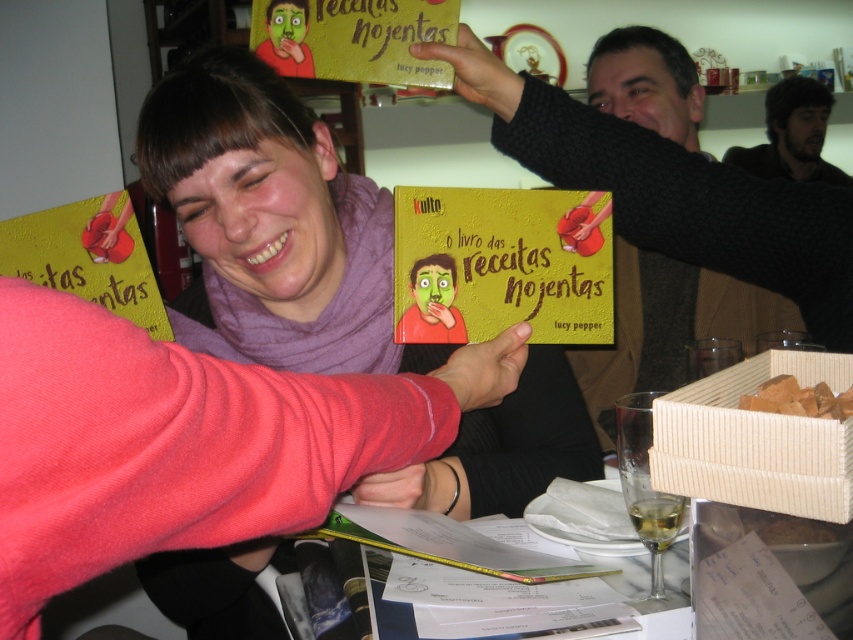
You are at a book signing event and want to place a new book into the beige woven basket at lower right. However, you notice the dark brown hair at upper right is nearby. Based on their heights, will the book fit into the basket without the hair blocking it?

The beige woven basket at lower right is not as tall as the dark brown hair at upper right, so the book should fit into the basket without being blocked by the hair.

You are at a book signing event and see a beige woven basket at lower right and a dark brown hair at upper right. Which object is smaller in size?

The beige woven basket at lower right is smaller in size compared to the dark brown hair at upper right.

You are standing in the scene and want to place a 12 inch long object in the beige woven basket at lower right. Can you fit it inside the basket?

The beige woven basket at lower right is 16.39 inches away from viewer. Since the distance is greater than the object length, you can place the 12 inch long object in the basket as it will fit within the available space.